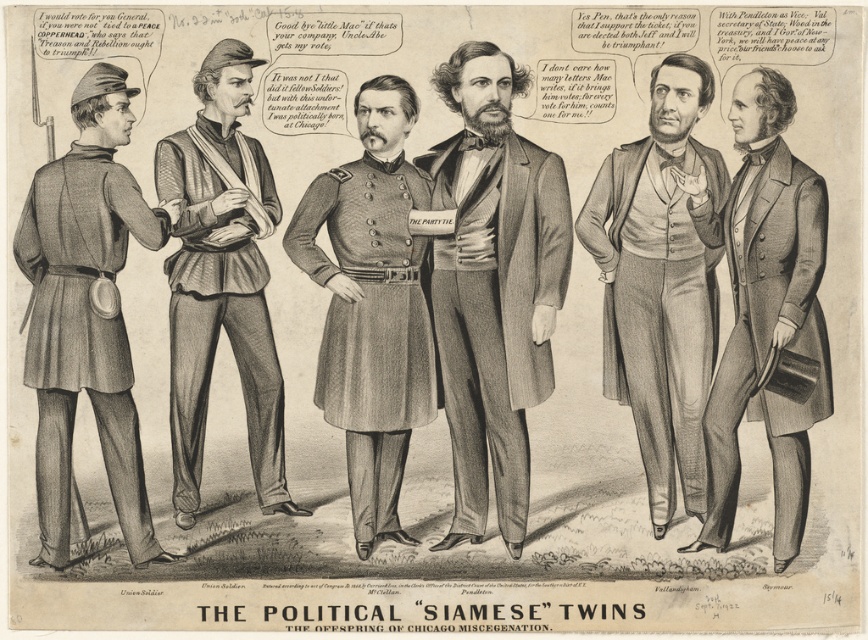
Is smooth gray suit at center above gray wool military coat at center?

Incorrect, smooth gray suit at center is not positioned above gray wool military coat at center.

Find the location of `smooth gray suit at center`. smooth gray suit at center is located at coordinates (492, 285).

Can you confirm if smooth gray suit at center is wider than smooth gray vest at center?

Correct, the width of smooth gray suit at center exceeds that of smooth gray vest at center.

Image resolution: width=868 pixels, height=640 pixels. What do you see at coordinates (492, 285) in the screenshot? I see `smooth gray suit at center` at bounding box center [492, 285].

You are a GUI agent. You are given a task and a screenshot of the screen. Output one action in this format:
    pyautogui.click(x=<x>, y=<y>)
    Task: Click on the smooth gray suit at center
    
    Given the screenshot: What is the action you would take?
    pyautogui.click(x=492, y=285)

Locate an element on the screen. This screenshot has width=868, height=640. smooth gray suit at center is located at coordinates (492, 285).

Is point (211, 208) positioned behind point (409, 397)?

No, (211, 208) is closer to viewer.

Is point (208, 337) less distant than point (353, 428)?

No, (208, 337) is behind (353, 428).

The height and width of the screenshot is (640, 868). Find the location of `rustic leather vest at center`. rustic leather vest at center is located at coordinates (221, 280).